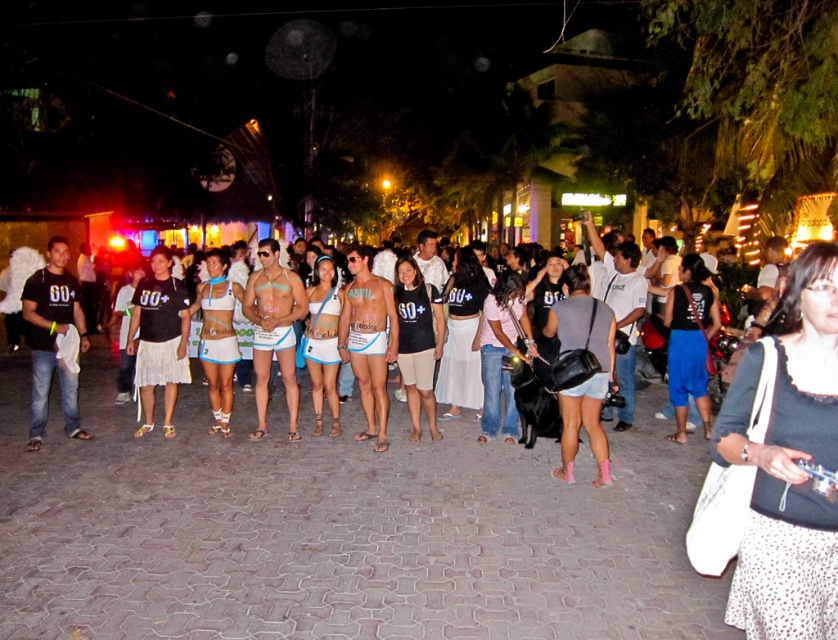
You are a photographer at the event and want to ensure that both the white dotted fabric at center and the pink fabric shirt at center are visible in your photo. Given their sizes, which one might you need to adjust the camera angle to better capture?

The white dotted fabric at center is not as tall as the pink fabric shirt at center, so you might need to adjust the camera angle to ensure the white dotted fabric at center is visible since it is shorter and could be obscured by the taller pink fabric shirt at center.

Looking at this image, you are standing in the nighttime outdoor scene and want to move from the point at coordinates point (787, 518) to the point at coordinates point (526, 348). Which direction should you move to get closer to the streetlights?

To move from point (787, 518) to point (526, 348), you should move towards the upper left direction because point (526, 348) is further away from the viewer compared to point (787, 518), which means it is located in the upper left direction relative to the original position.